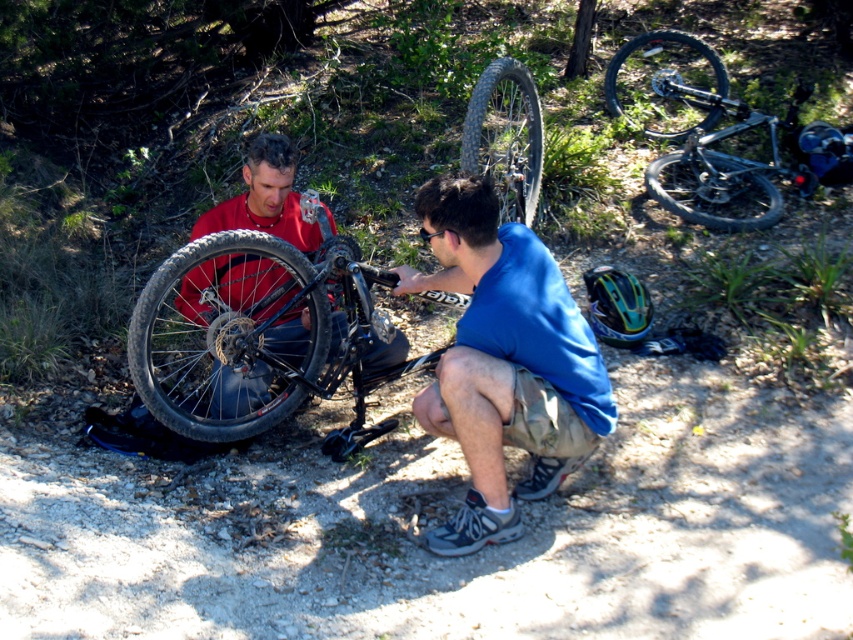
Question: Among these points, which one is farthest from the camera?

Choices:
 (A) (534, 148)
 (B) (544, 387)
 (C) (648, 115)

Answer: (C)

Question: Is black matte bicycle wheel at center-left above shiny metallic bicycle wheel at center?

Choices:
 (A) yes
 (B) no

Answer: (B)

Question: Is blue fabric shirt at center above black rubber tire at upper right?

Choices:
 (A) yes
 (B) no

Answer: (B)

Question: Which object appears closest to the camera in this image?

Choices:
 (A) black matte bicycle wheel at center-left
 (B) black matte mountain bike at upper right

Answer: (A)

Question: Which point is farther to the camera?

Choices:
 (A) (688, 179)
 (B) (700, 42)
 (C) (447, 545)
 (D) (524, 83)

Answer: (B)

Question: Can you confirm if blue fabric shirt at center is thinner than black matte bicycle wheel at upper right?

Choices:
 (A) no
 (B) yes

Answer: (B)